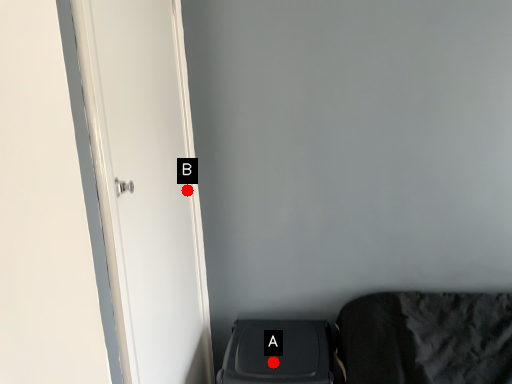
Question: Two points are circled on the image, labeled by A and B beside each circle. Which point is farther from the camera taking this photo?

Choices:
 (A) A is further
 (B) B is further

Answer: (B)